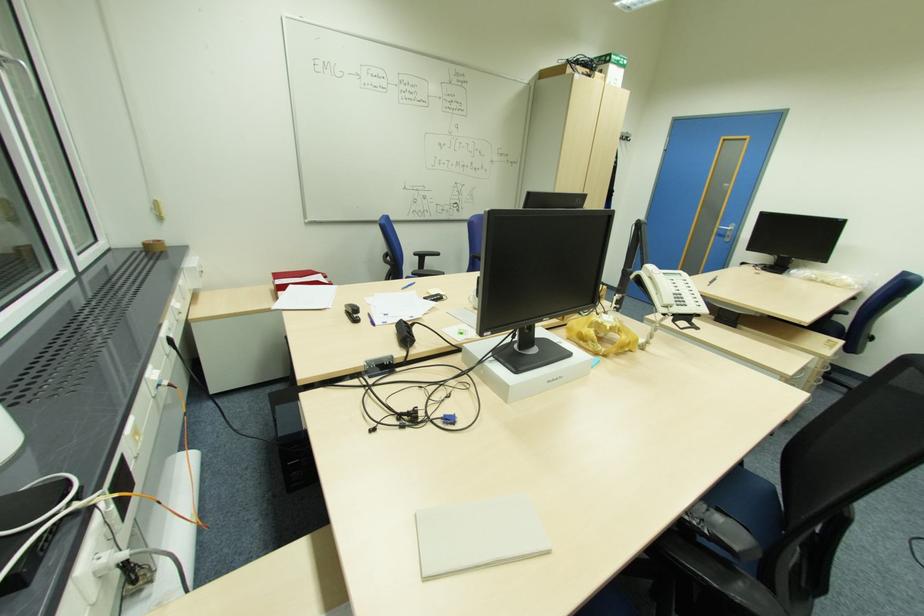
Find where to rest the black chair armrest. Please return your answer as a coordinate pair (x, y).

(722, 532)